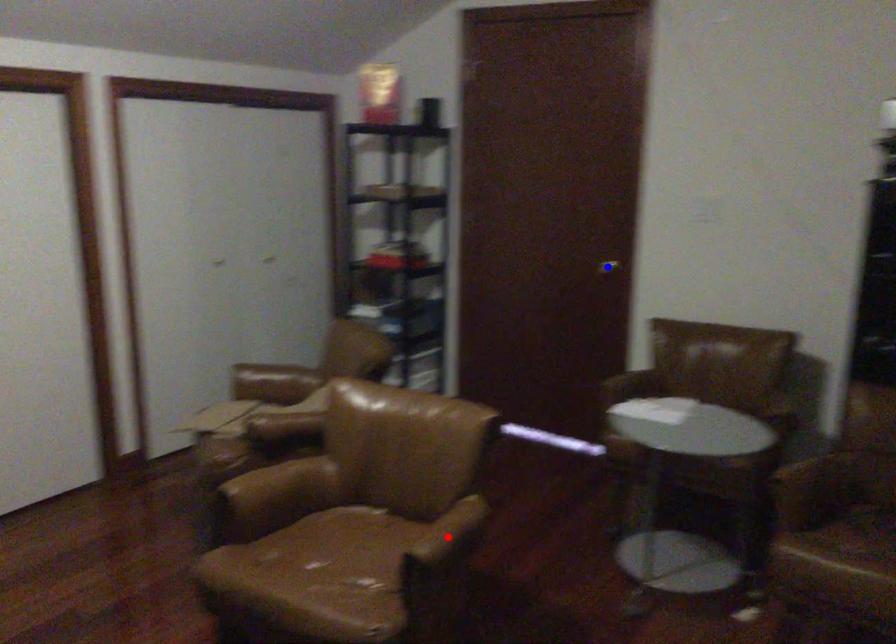
Question: Two points are marked on the image. Which point is closer to the camera?

Choices:
 (A) Blue point is closer.
 (B) Red point is closer.

Answer: (B)